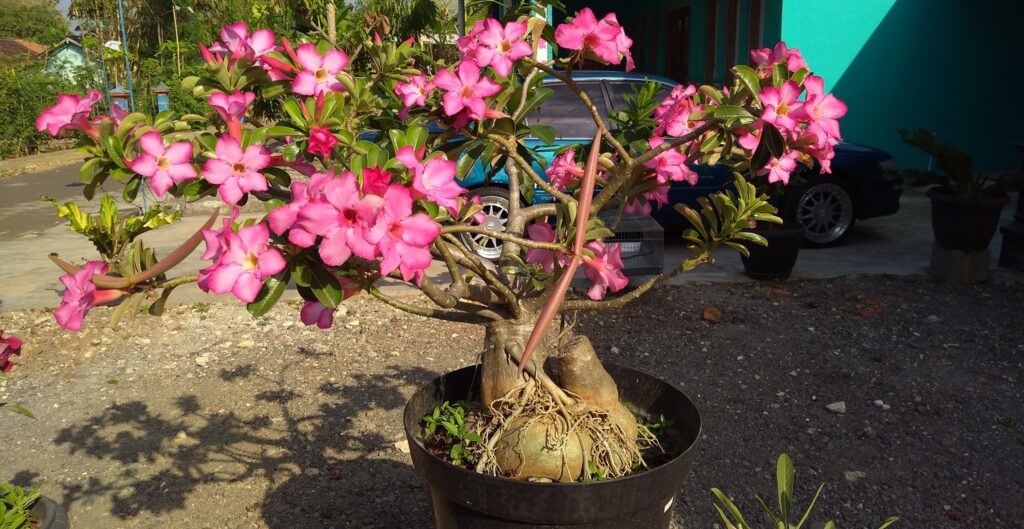
Identify the location of plant. (539, 211).